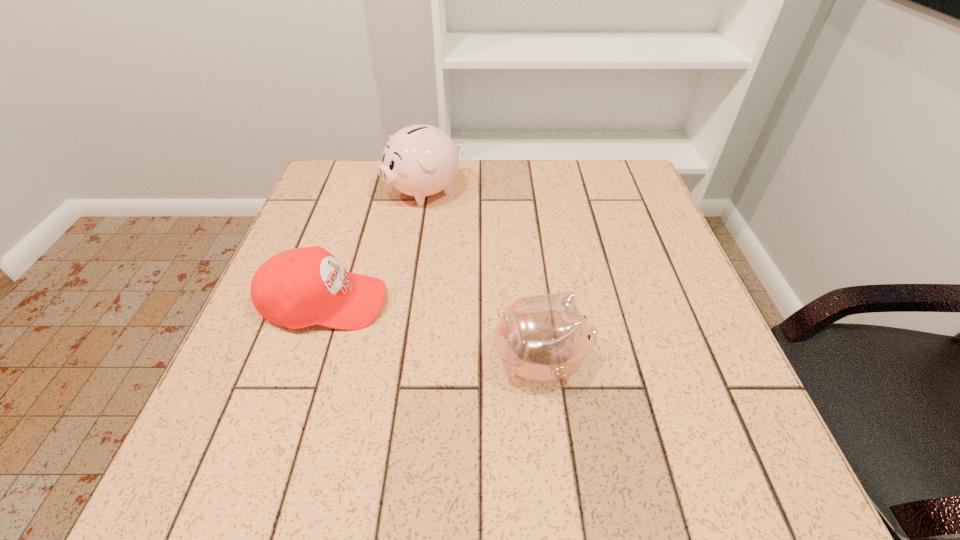
Locate an element on the screen. The height and width of the screenshot is (540, 960). the left piggy bank is located at coordinates (420, 160).

I want to click on the taller piggy bank, so click(420, 160).

Locate an element on the screen. This screenshot has width=960, height=540. the rightmost object is located at coordinates (544, 338).

Locate an element on the screen. the right piggy bank is located at coordinates click(x=544, y=338).

Locate an element on the screen. baseball cap is located at coordinates (300, 287).

This screenshot has width=960, height=540. I want to click on free space located 0.130m on the left of the farthest object, so click(335, 192).

Identify the location of free region located 0.230m on the front facing side of the right piggy bank. The image size is (960, 540). (717, 362).

Where is `vacant space situated 0.230m on the front panel of the baseball cap`? The width and height of the screenshot is (960, 540). vacant space situated 0.230m on the front panel of the baseball cap is located at coordinates (501, 303).

Where is `object at the far edge`? This screenshot has width=960, height=540. object at the far edge is located at coordinates (420, 160).

I want to click on object that is at the left edge, so click(300, 287).